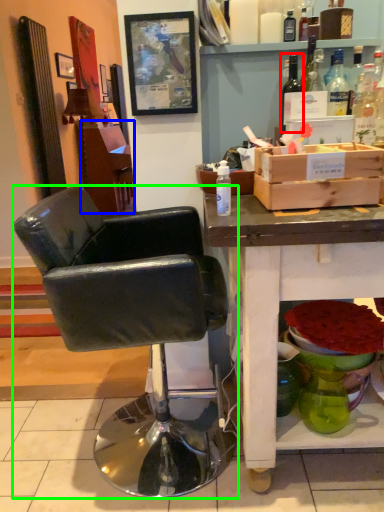
Question: Which is farther away from bottle (highlighted by a red box)? vanity (highlighted by a blue box) or chair (highlighted by a green box)?

Choices:
 (A) vanity
 (B) chair

Answer: (A)